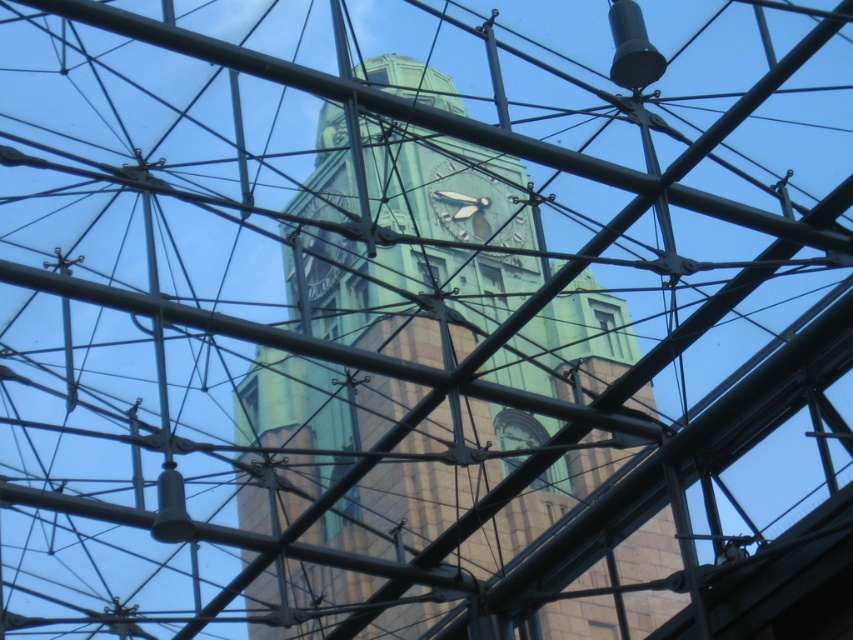
You are an architect designing a new observation deck. You need to place a new decorative element between the green metallic clock tower at center and the green stone clock at center. According to the image, which clock is on the left side to guide placement?

The green metallic clock tower at center is positioned on the left side of the green stone clock at center, so the decorative element should be placed between them with the green metallic clock tower at center on the left and the green stone clock at center on the right.

You are standing in a modern architectural structure with metal beams and cables. You want to locate the green metallic clock tower at center. According to the coordinates provided, where exactly is it positioned?

The green metallic clock tower at center is located at coordinates point (x=399, y=248).